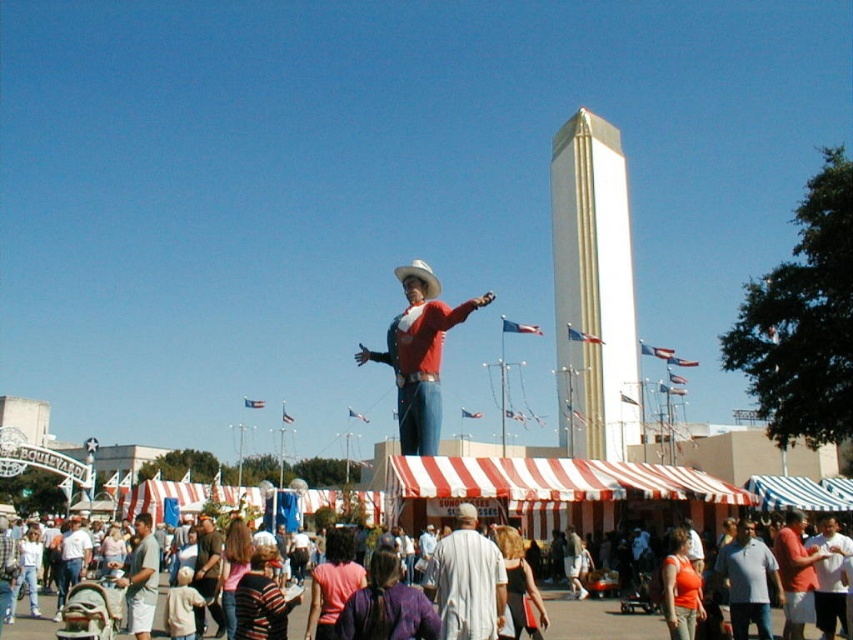
Does point (495, 600) come closer to viewer compared to point (149, 576)?

Yes, point (495, 600) is closer to viewer.

Is light gray cotton shirt at center shorter than light brown shirt at lower left?

Correct, light gray cotton shirt at center is not as tall as light brown shirt at lower left.

This screenshot has width=853, height=640. What are the coordinates of `light gray cotton shirt at center` in the screenshot? It's located at (467, 580).

Can you confirm if white smooth obelisk at center is positioned to the left of light brown shirt at lower left?

No, white smooth obelisk at center is not to the left of light brown shirt at lower left.

Is white smooth obelisk at center smaller than light brown shirt at lower left?

Incorrect, white smooth obelisk at center is not smaller in size than light brown shirt at lower left.

Measure the distance between point [579,317] and camera.

The distance of point [579,317] from camera is 127.58 meters.

Where is `white smooth obelisk at center`? white smooth obelisk at center is located at coordinates (593, 291).

The height and width of the screenshot is (640, 853). Find the location of `white smooth obelisk at center`. white smooth obelisk at center is located at coordinates (593, 291).

Does white smooth obelisk at center come behind matte red shirt at center?

Yes, white smooth obelisk at center is further from the viewer.

Which is behind, point (561, 435) or point (428, 371)?

The point (561, 435) is behind.

You are a GUI agent. You are given a task and a screenshot of the screen. Output one action in this format:
    pyautogui.click(x=<x>, y=<y>)
    Task: Click on the white smooth obelisk at center
    
    Given the screenshot: What is the action you would take?
    pyautogui.click(x=593, y=291)